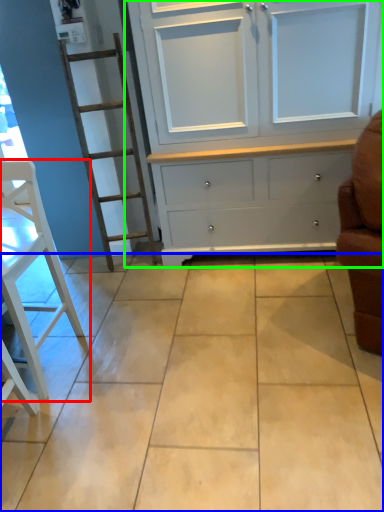
Question: Which object is positioned closest to furniture (highlighted by a red box)? Select from ceramic tile (highlighted by a blue box) and cupboard (highlighted by a green box).

Choices:
 (A) ceramic tile
 (B) cupboard

Answer: (A)